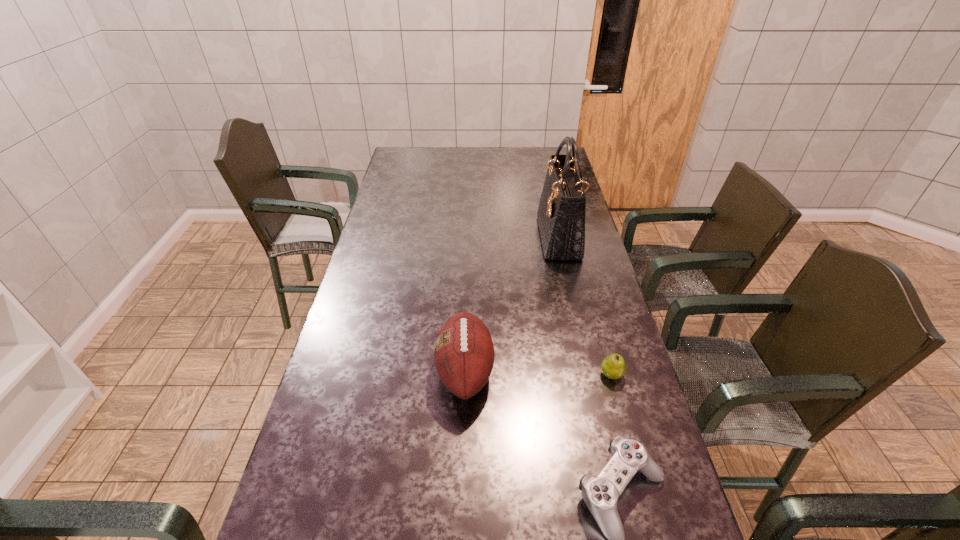
Find the location of a particular element. The width and height of the screenshot is (960, 540). handbag at the right edge is located at coordinates (561, 213).

The height and width of the screenshot is (540, 960). In order to click on pear positioned at the right edge in this screenshot , I will do `click(613, 366)`.

You are a GUI agent. You are given a task and a screenshot of the screen. Output one action in this format:
    pyautogui.click(x=<x>, y=<y>)
    Task: Click on the blank space at the far edge of the desktop
    
    Given the screenshot: What is the action you would take?
    pyautogui.click(x=501, y=168)

Identify the location of free region at the left edge of the desktop. click(344, 355).

Identify the location of vacant space at the right edge of the desktop. (601, 298).

Image resolution: width=960 pixels, height=540 pixels. Find the location of `free point between the tallest object and the pear`. free point between the tallest object and the pear is located at coordinates (585, 306).

At what (x,y) coordinates should I click in order to perform the action: click on free space that is in between the pear and the handbag. Please return your answer as a coordinate pair (x, y). The height and width of the screenshot is (540, 960). Looking at the image, I should click on (585, 306).

This screenshot has width=960, height=540. Identify the location of free space between the third tallest object and the tallest object. (585, 306).

Identify the location of free point between the third shortest object and the tallest object. (512, 304).

Locate an element on the screen. The height and width of the screenshot is (540, 960). free space between the leftmost object and the tallest object is located at coordinates (512, 304).